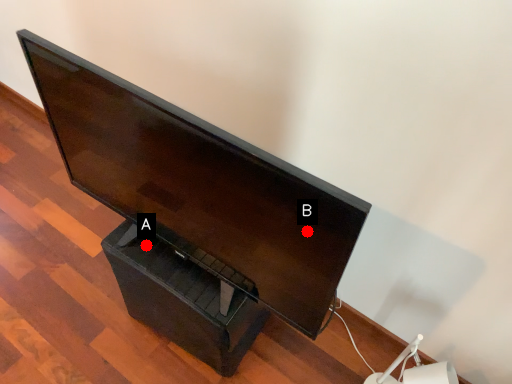
Question: Two points are circled on the image, labeled by A and B beside each circle. Which point is closer to the camera?

Choices:
 (A) A is closer
 (B) B is closer

Answer: (B)